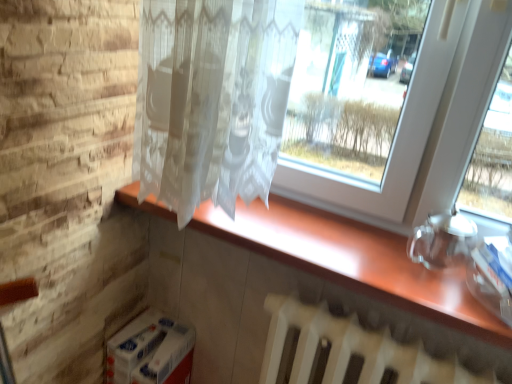
Find the location of a particular element. Image resolution: width=512 pixels, height=384 pixels. blank space situated above wooden counter at center (from a real-world perspective) is located at coordinates (354, 247).